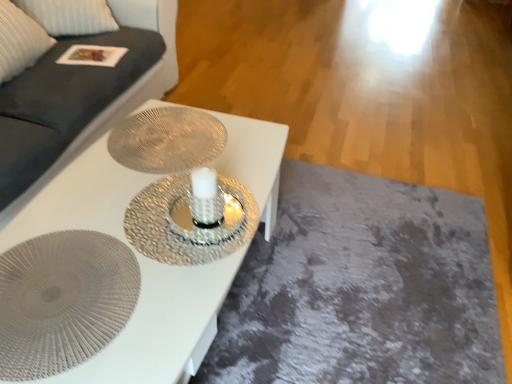
You are a GUI agent. You are given a task and a screenshot of the screen. Output one action in this format:
    pyautogui.click(x=<x>, y=<y>)
    Task: Click on the vacant area situated below textured silver plate at center, which is the 2th oval in top-to-bottom order (from a real-world perspective)
    
    Given the screenshot: What is the action you would take?
    pyautogui.click(x=64, y=292)